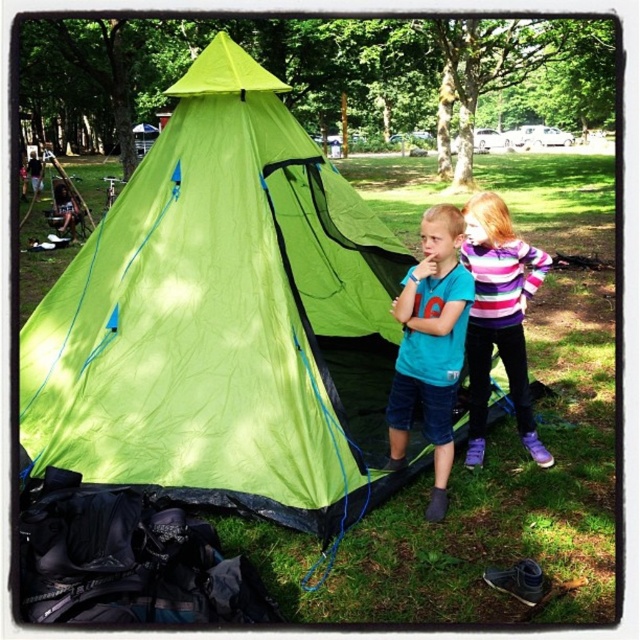
Question: Does teal matte shirt at center have a smaller size compared to striped sweater at center?

Choices:
 (A) no
 (B) yes

Answer: (B)

Question: Is green fabric tent at center positioned before striped sweater at center?

Choices:
 (A) yes
 (B) no

Answer: (A)

Question: Which point appears closest to the camera in this image?

Choices:
 (A) (483, 248)
 (B) (179, 307)
 (C) (429, 317)

Answer: (C)

Question: Can you confirm if green fabric tent at center is positioned below striped sweater at center?

Choices:
 (A) yes
 (B) no

Answer: (A)

Question: Based on their relative distances, which object is nearer to the teal matte shirt at center?

Choices:
 (A) striped sweater at center
 (B) green fabric tent at center

Answer: (A)

Question: Which point is closer to the camera?

Choices:
 (A) (298, 243)
 (B) (445, 502)

Answer: (B)